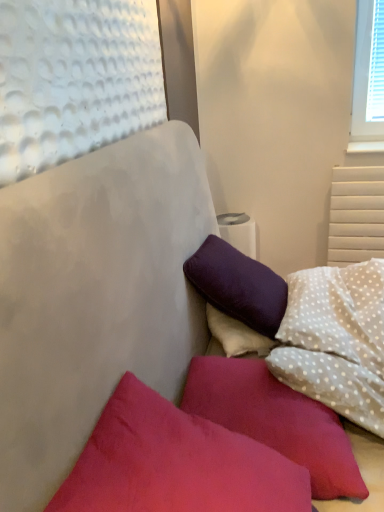
Question: Considering the relative positions of matte pink pillow at lower left, which is the 2th pillow in back-to-front order, and suede-like red pillow at lower center, marked as the first pillow in a front-to-back arrangement, in the image provided, is matte pink pillow at lower left, which is the 2th pillow in back-to-front order, to the left or to the right of suede-like red pillow at lower center, marked as the first pillow in a front-to-back arrangement,?

Choices:
 (A) right
 (B) left

Answer: (A)

Question: Does point (331, 497) appear closer or farther from the camera than point (220, 466)?

Choices:
 (A) closer
 (B) farther

Answer: (B)

Question: Which of these objects is positioned closest to the white dotted fabric pillow at upper right, which is counted as the 1th pillow, starting from the back?

Choices:
 (A) matte pink pillow at lower left, which is the 2th pillow in back-to-front order
 (B) suede-like red pillow at lower center, marked as the first pillow in a front-to-back arrangement

Answer: (A)

Question: Which of these objects is positioned closest to the matte pink pillow at lower left, the 2th pillow positioned from the front?

Choices:
 (A) white dotted fabric pillow at upper right, marked as the 3th pillow in a front-to-back arrangement
 (B) suede-like red pillow at lower center, which is the 3th pillow from back to front

Answer: (B)